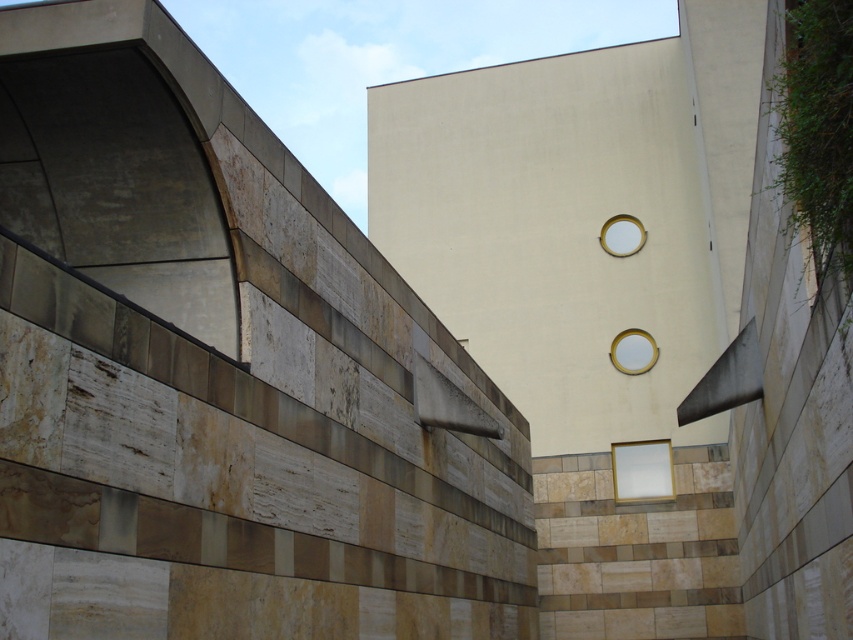
Question: From the image, what is the correct spatial relationship of matte gold circle at center in relation to matte gold circle at upper center?

Choices:
 (A) above
 (B) below

Answer: (B)

Question: Is matte gold circle at center smaller than matte gold circle at upper center?

Choices:
 (A) no
 (B) yes

Answer: (B)

Question: Among these objects, which one is nearest to the camera?

Choices:
 (A) matte gold circle at upper center
 (B) matte gold circle at center

Answer: (B)

Question: Does matte gold circle at center appear on the left side of matte gold circle at upper center?

Choices:
 (A) yes
 (B) no

Answer: (B)

Question: Among these points, which one is farthest from the camera?

Choices:
 (A) (633, 344)
 (B) (635, 234)

Answer: (B)